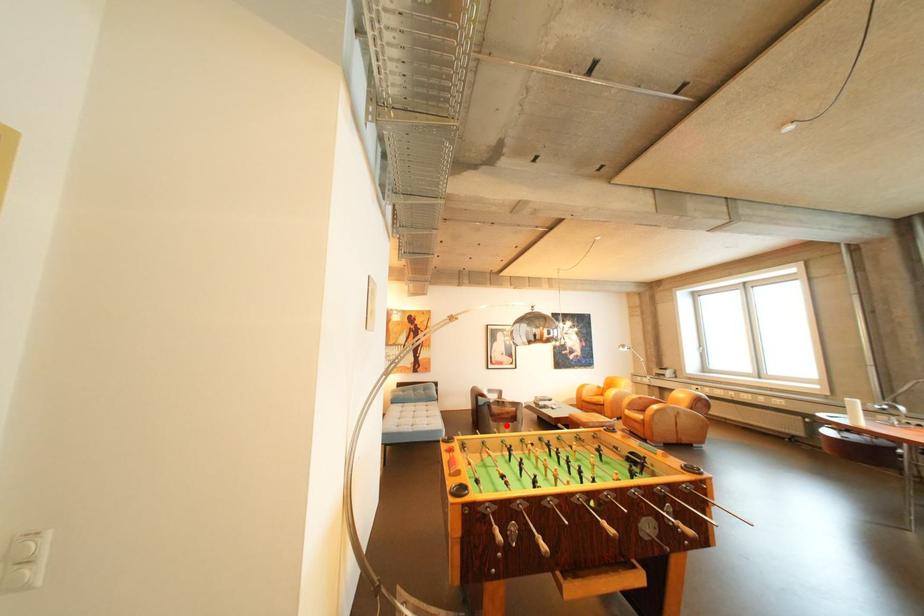
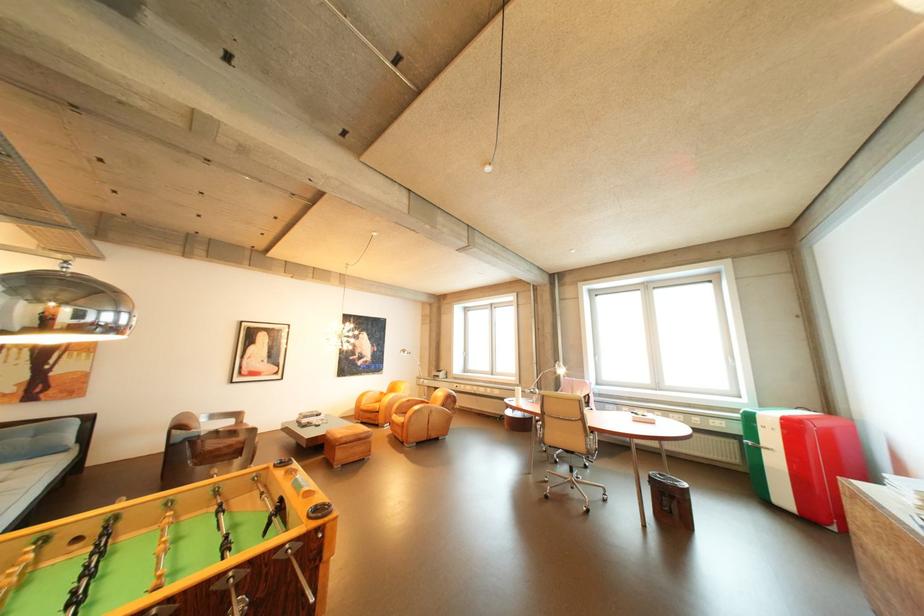
Question: I am providing you with two images of the same scene from different viewpoints. In image1, a red point is highlighted. Considering the same 3D point in image2, which of the following is correct?

Choices:
 (A) It is closer
 (B) It is farther

Answer: (A)